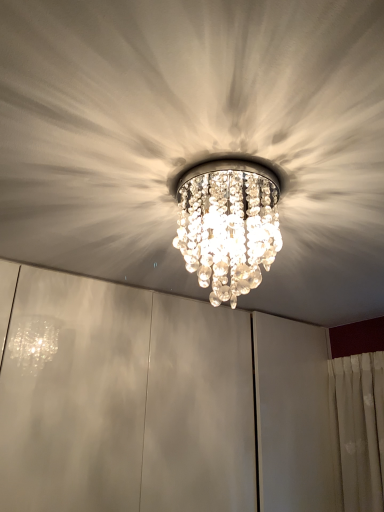
Question: From a real-world perspective, relative to clear crystal chandelier at center, is clear crystal chandelier at center vertically above or below?

Choices:
 (A) above
 (B) below

Answer: (B)

Question: Is clear crystal chandelier at center taller or shorter than clear crystal chandelier at center?

Choices:
 (A) short
 (B) tall

Answer: (B)

Question: Choose the correct answer: Is clear crystal chandelier at center inside clear crystal chandelier at center or outside it?

Choices:
 (A) outside
 (B) inside

Answer: (A)

Question: From their relative heights in the image, would you say clear crystal chandelier at center is taller or shorter than clear crystal chandelier at center?

Choices:
 (A) short
 (B) tall

Answer: (A)

Question: Would you say clear crystal chandelier at center is to the left or to the right of clear crystal chandelier at center in the picture?

Choices:
 (A) right
 (B) left

Answer: (A)

Question: Relative to clear crystal chandelier at center, is clear crystal chandelier at center in front or behind?

Choices:
 (A) front
 (B) behind

Answer: (A)

Question: In terms of width, does clear crystal chandelier at center look wider or thinner when compared to clear crystal chandelier at center?

Choices:
 (A) wide
 (B) thin

Answer: (A)